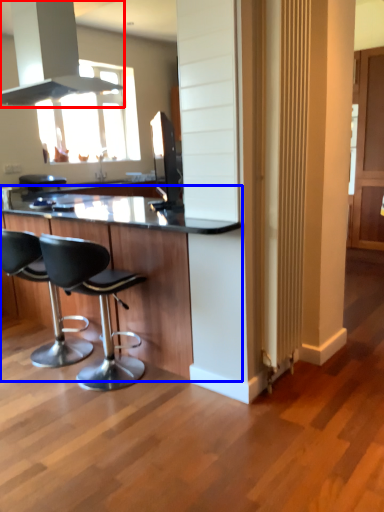
Question: Which object appears farthest to the camera in this image, exhaust hood (highlighted by a red box) or table (highlighted by a blue box)?

Choices:
 (A) exhaust hood
 (B) table

Answer: (A)